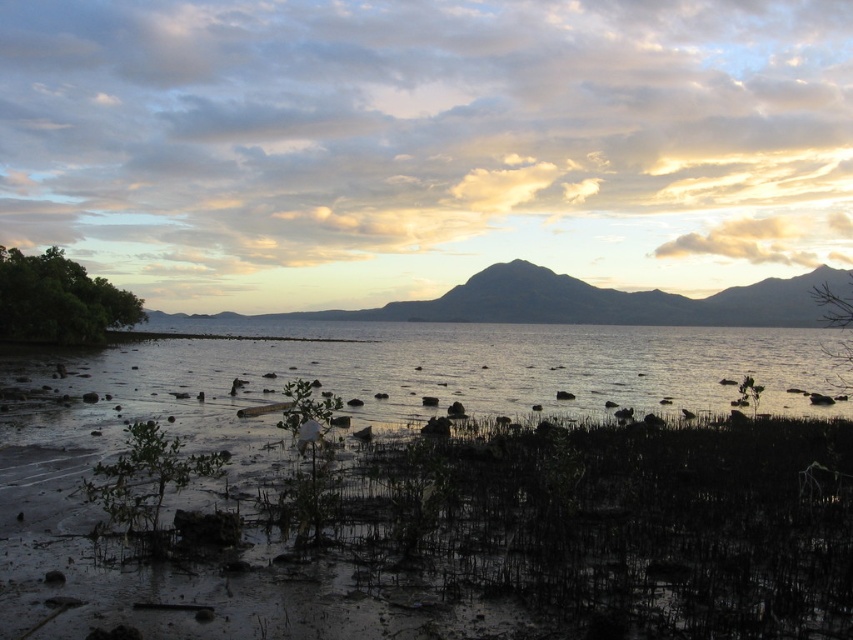
You are a bird flying over the coastal scene. You see the clear water at center and the smooth gray mountain at center. Which one is lower in height?

The clear water at center has a lesser height compared to the smooth gray mountain at center, so the clear water at center is lower in height.

You are standing on the muddy ground in the foreground of the coastal scene. You want to reach the clear water at center to collect a sample. In which direction should you walk from your current position?

You should walk towards the clear water at center located at point coordinates of (437, 371) to collect the sample.

Based on the photo, you are standing on the shore of the coastal scene and want to cross to the other side. You see the clear water at center and the smooth gray mountain at center. Which path would allow you to cross without getting wet?

The smooth gray mountain at center has a greater width than the clear water at center, so crossing over the smooth gray mountain at center would keep you dry.